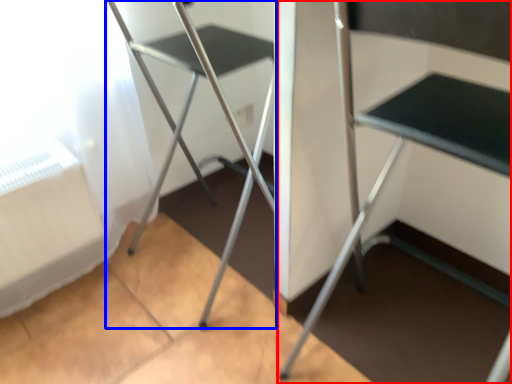
Question: Which of the following is the closest to the observer, furniture (highlighted by a red box) or chair (highlighted by a blue box)?

Choices:
 (A) furniture
 (B) chair

Answer: (A)